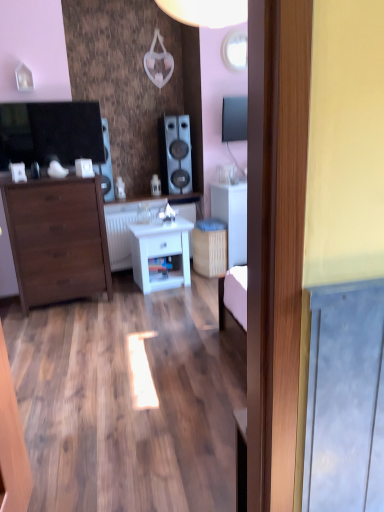
The height and width of the screenshot is (512, 384). Find the location of `free space in front of matte brown chest of drawers at left`. free space in front of matte brown chest of drawers at left is located at coordinates (55, 323).